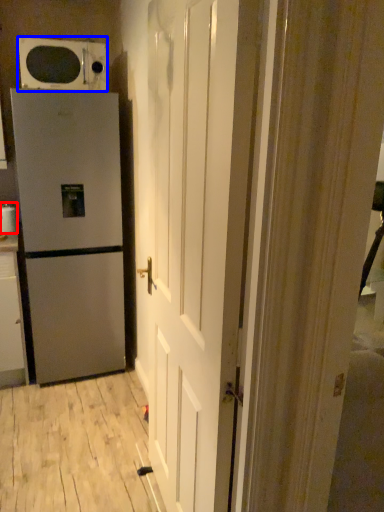
Question: Which of the following is the closest to the observer, appliance (highlighted by a red box) or microwave oven (highlighted by a blue box)?

Choices:
 (A) appliance
 (B) microwave oven

Answer: (B)